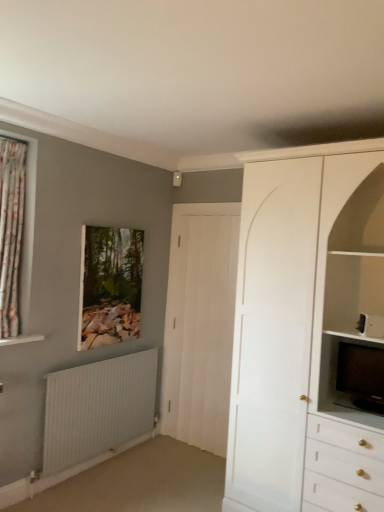
Question: Can we say black glossy television at right lies outside white ribbed radiator at lower left?

Choices:
 (A) yes
 (B) no

Answer: (A)

Question: Is black glossy television at right further to camera compared to white ribbed radiator at lower left?

Choices:
 (A) yes
 (B) no

Answer: (B)

Question: Considering the relative sizes of black glossy television at right and white ribbed radiator at lower left in the image provided, is black glossy television at right smaller than white ribbed radiator at lower left?

Choices:
 (A) no
 (B) yes

Answer: (B)

Question: From a real-world perspective, is black glossy television at right under white ribbed radiator at lower left?

Choices:
 (A) yes
 (B) no

Answer: (B)

Question: Does black glossy television at right contain white ribbed radiator at lower left?

Choices:
 (A) no
 (B) yes

Answer: (A)

Question: Considering the relative positions of black glossy television at right and white ribbed radiator at lower left in the image provided, is black glossy television at right to the right of white ribbed radiator at lower left from the viewer's perspective?

Choices:
 (A) yes
 (B) no

Answer: (A)

Question: Is floral fabric curtain at left at the right side of white ribbed radiator at lower left?

Choices:
 (A) no
 (B) yes

Answer: (A)

Question: Could you tell me if floral fabric curtain at left is turned towards white ribbed radiator at lower left?

Choices:
 (A) yes
 (B) no

Answer: (B)

Question: Does floral fabric curtain at left have a lesser width compared to white ribbed radiator at lower left?

Choices:
 (A) no
 (B) yes

Answer: (A)

Question: Considering the relative sizes of floral fabric curtain at left and white ribbed radiator at lower left in the image provided, is floral fabric curtain at left taller than white ribbed radiator at lower left?

Choices:
 (A) no
 (B) yes

Answer: (B)

Question: Is floral fabric curtain at left outside of white ribbed radiator at lower left?

Choices:
 (A) yes
 (B) no

Answer: (A)

Question: Is floral fabric curtain at left closer to the viewer compared to white ribbed radiator at lower left?

Choices:
 (A) no
 (B) yes

Answer: (B)

Question: Does white ribbed radiator at lower left have a lesser width compared to white matte cabinet at upper right?

Choices:
 (A) yes
 (B) no

Answer: (A)